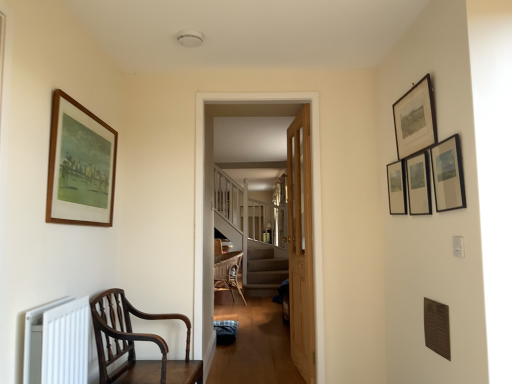
At what (x,y) coordinates should I click in order to perform the action: click on matte black picture frame at upper right, placed as the fourth picture frame when sorted from left to right. Please return your answer as a coordinate pair (x, y). Looking at the image, I should click on (418, 184).

This screenshot has height=384, width=512. Describe the element at coordinates (301, 246) in the screenshot. I see `wooden door at center` at that location.

Measure the distance between mahogany wood chair at lower left and camera.

mahogany wood chair at lower left and camera are 6.90 feet apart.

Describe the element at coordinates (134, 347) in the screenshot. I see `mahogany wood chair at lower left` at that location.

This screenshot has height=384, width=512. What do you see at coordinates (80, 165) in the screenshot?
I see `wooden framed print at upper left, the fifth picture frame viewed from the right` at bounding box center [80, 165].

What do you see at coordinates (57, 342) in the screenshot?
I see `white matte radiator at lower left` at bounding box center [57, 342].

I want to click on matte black picture frame at upper right, placed as the fourth picture frame when sorted from left to right, so click(418, 184).

Is matte black picture frame at upper right, the third picture frame from the right, far away from wooden framed print at upper left, the fifth picture frame viewed from the right?

Yes, matte black picture frame at upper right, the third picture frame from the right, and wooden framed print at upper left, the fifth picture frame viewed from the right, are quite far apart.

Which object is wider, matte black picture frame at upper right, which ranks as the third picture frame in left-to-right order, or wooden framed print at upper left, the first picture frame viewed from the left?

wooden framed print at upper left, the first picture frame viewed from the left.

Looking at this image, how many degrees apart are the facing directions of matte black picture frame at upper right, the third picture frame from the right, and wooden framed print at upper left, the first picture frame viewed from the left?

The angular difference between matte black picture frame at upper right, the third picture frame from the right, and wooden framed print at upper left, the first picture frame viewed from the left, is 180 degrees.

Is matte black picture frame at upper right, which ranks as the third picture frame in left-to-right order, looking in the opposite direction of wooden framed print at upper left, the fifth picture frame viewed from the right?

No, wooden framed print at upper left, the fifth picture frame viewed from the right, is not at the back of matte black picture frame at upper right, which ranks as the third picture frame in left-to-right order.

Is matte black picture frame at upper right, the third picture frame from the right, thinner than white matte radiator at lower left?

Indeed, matte black picture frame at upper right, the third picture frame from the right, has a lesser width compared to white matte radiator at lower left.

At what (x,y) coordinates should I click in order to perform the action: click on radiator in front of the matte black picture frame at upper right, the third picture frame from the right. Please return your answer as a coordinate pair (x, y). Image resolution: width=512 pixels, height=384 pixels. Looking at the image, I should click on (57, 342).

Between matte black picture frame at upper right, the third picture frame from the right, and white matte radiator at lower left, which one has larger size?

white matte radiator at lower left.

Is matte black picture frame at upper right, which ranks as the third picture frame in left-to-right order, facing towards white matte radiator at lower left?

Yes.

Is mahogany wood chair at lower left not within white matte radiator at lower left?

Yes, mahogany wood chair at lower left is not within white matte radiator at lower left.

Consider the image. Which of these two, mahogany wood chair at lower left or white matte radiator at lower left, is wider?

Wider between the two is mahogany wood chair at lower left.

Which object is closer to the camera, mahogany wood chair at lower left or white matte radiator at lower left?

white matte radiator at lower left is in front.

Is mahogany wood chair at lower left touching white matte radiator at lower left?

They are not placed beside each other.

Considering the sizes of objects matte black picture frame at upper right, the 1th picture frame in the right-to-left sequence, and mahogany wood chair at lower left in the image provided, who is bigger, matte black picture frame at upper right, the 1th picture frame in the right-to-left sequence, or mahogany wood chair at lower left?

mahogany wood chair at lower left.

Is matte black picture frame at upper right, marked as the fifth picture frame in a left-to-right arrangement, placed right next to mahogany wood chair at lower left?

No, matte black picture frame at upper right, marked as the fifth picture frame in a left-to-right arrangement, is not touching mahogany wood chair at lower left.

In the scene shown: Would you say matte black picture frame at upper right, marked as the fifth picture frame in a left-to-right arrangement, is to the left or to the right of mahogany wood chair at lower left in the picture?

matte black picture frame at upper right, marked as the fifth picture frame in a left-to-right arrangement, is to the right of mahogany wood chair at lower left.

Does matte black picture frame at upper right, marked as the fifth picture frame in a left-to-right arrangement, come in front of mahogany wood chair at lower left?

Yes, the depth of matte black picture frame at upper right, marked as the fifth picture frame in a left-to-right arrangement, is less than that of mahogany wood chair at lower left.

Which of these two, wooden framed print at upper left, the fifth picture frame viewed from the right, or matte black picture frame at upper right, placed as the fourth picture frame when sorted from left to right, is wider?

Wider between the two is wooden framed print at upper left, the fifth picture frame viewed from the right.

How many degrees apart are the facing directions of wooden framed print at upper left, the first picture frame viewed from the left, and matte black picture frame at upper right, placed as the fourth picture frame when sorted from left to right?

178 degrees separate the facing orientations of wooden framed print at upper left, the first picture frame viewed from the left, and matte black picture frame at upper right, placed as the fourth picture frame when sorted from left to right.

Considering the relative positions of wooden framed print at upper left, the fifth picture frame viewed from the right, and matte black picture frame at upper right, placed as the fourth picture frame when sorted from left to right, in the image provided, is wooden framed print at upper left, the fifth picture frame viewed from the right, to the right of matte black picture frame at upper right, placed as the fourth picture frame when sorted from left to right, from the viewer's perspective?

In fact, wooden framed print at upper left, the fifth picture frame viewed from the right, is to the left of matte black picture frame at upper right, placed as the fourth picture frame when sorted from left to right.

Who is smaller, wooden framed print at upper left, the first picture frame viewed from the left, or matte black picture frame at upper right, placed as the fourth picture frame when sorted from left to right?

With smaller size is matte black picture frame at upper right, placed as the fourth picture frame when sorted from left to right.

Between wooden framed print at upper left, the fifth picture frame viewed from the right, and matte black picture frame at upper right, marked as the fifth picture frame in a left-to-right arrangement, which one has smaller width?

matte black picture frame at upper right, marked as the fifth picture frame in a left-to-right arrangement, is thinner.

Is matte black picture frame at upper right, the 1th picture frame in the right-to-left sequence, a part of wooden framed print at upper left, the fifth picture frame viewed from the right?

No, matte black picture frame at upper right, the 1th picture frame in the right-to-left sequence, is not inside wooden framed print at upper left, the fifth picture frame viewed from the right.

What are the coordinates of `the 1st picture frame behind the matte black picture frame at upper right, the 1th picture frame in the right-to-left sequence` in the screenshot? It's located at (80, 165).

Is matte black picture frame at upper right, placed as the second picture frame when sorted from right to left, facing towards matte black picture frame at upper right, marked as the fifth picture frame in a left-to-right arrangement?

No, matte black picture frame at upper right, placed as the second picture frame when sorted from right to left, is not facing towards matte black picture frame at upper right, marked as the fifth picture frame in a left-to-right arrangement.

From a real-world perspective, is matte black picture frame at upper right, placed as the second picture frame when sorted from right to left, positioned above or below matte black picture frame at upper right, marked as the fifth picture frame in a left-to-right arrangement?

matte black picture frame at upper right, placed as the second picture frame when sorted from right to left, is below matte black picture frame at upper right, marked as the fifth picture frame in a left-to-right arrangement.

Identify the location of picture frame that is the 1st object located above the matte black picture frame at upper right, placed as the fourth picture frame when sorted from left to right (from the image's perspective). (448, 174).

Starting from the matte black picture frame at upper right, which ranks as the third picture frame in left-to-right order, which picture frame is the 2nd one to the left? Please provide its 2D coordinates.

[(80, 165)]

This screenshot has height=384, width=512. I want to click on picture frame that is the 5th object located behind the white matte radiator at lower left, so coord(397,187).

Looking at the image, which one is located closer to matte black picture frame at upper right, which ranks as the third picture frame in left-to-right order, matte black picture frame at upper right, the 1th picture frame in the right-to-left sequence, or wooden door at center?

matte black picture frame at upper right, the 1th picture frame in the right-to-left sequence, is positioned closer to the anchor matte black picture frame at upper right, which ranks as the third picture frame in left-to-right order.

When comparing their distances from white matte radiator at lower left, does matte black picture frame at upper right, the third picture frame from the right, or wooden framed print at upper left, the first picture frame viewed from the left, seem closer?

Based on the image, wooden framed print at upper left, the first picture frame viewed from the left, appears to be nearer to white matte radiator at lower left.

Considering their positions, is matte black picture frame at upper right, placed as the fourth picture frame when sorted from left to right, positioned further to matte black picture frame at upper right, marked as the fifth picture frame in a left-to-right arrangement, than matte black picture frame at upper right, which ranks as the third picture frame in left-to-right order?

The object further to matte black picture frame at upper right, marked as the fifth picture frame in a left-to-right arrangement, is matte black picture frame at upper right, which ranks as the third picture frame in left-to-right order.

Considering their positions, is wooden door at center positioned further to matte black picture frame at upper right, the 1th picture frame in the right-to-left sequence, than wooden framed print at upper left, the fifth picture frame viewed from the right?

Among the two, wooden framed print at upper left, the fifth picture frame viewed from the right, is located further to matte black picture frame at upper right, the 1th picture frame in the right-to-left sequence.

Estimate the real-world distances between objects in this image. Which object is closer to matte black picture frame at upper right, the 1th picture frame in the right-to-left sequence, mahogany wood chair at lower left or matte black picture frame at upper right, placed as the fourth picture frame when sorted from left to right?

matte black picture frame at upper right, placed as the fourth picture frame when sorted from left to right, is positioned closer to the anchor matte black picture frame at upper right, the 1th picture frame in the right-to-left sequence.

Looking at the image, which one is located further to matte black picture frame at upper right, placed as the fourth picture frame when sorted from left to right, wooden picture frame at upper right, the fourth picture frame when ordered from right to left, or wooden door at center?

wooden door at center is positioned further to the anchor matte black picture frame at upper right, placed as the fourth picture frame when sorted from left to right.

Based on their spatial positions, is wooden framed print at upper left, the first picture frame viewed from the left, or wooden door at center closer to wooden door at center?

The object closer to wooden door at center is wooden door at center.

When comparing their distances from wooden door at center, does matte black picture frame at upper right, placed as the fourth picture frame when sorted from left to right, or matte black picture frame at upper right, marked as the fifth picture frame in a left-to-right arrangement, seem closer?

matte black picture frame at upper right, placed as the fourth picture frame when sorted from left to right, is positioned closer to the anchor wooden door at center.

Locate an element on the screen. This screenshot has height=384, width=512. door located between wooden framed print at upper left, the fifth picture frame viewed from the right, and wooden picture frame at upper right, the fourth picture frame when ordered from right to left, in the left-right direction is located at coordinates [301, 246].

At what (x,y) coordinates should I click in order to perform the action: click on radiator between wooden framed print at upper left, the fifth picture frame viewed from the right, and wooden picture frame at upper right, which is counted as the second picture frame, starting from the left. Please return your answer as a coordinate pair (x, y). The height and width of the screenshot is (384, 512). Looking at the image, I should click on (57, 342).

You are a GUI agent. You are given a task and a screenshot of the screen. Output one action in this format:
    pyautogui.click(x=<x>, y=<y>)
    Task: Click on the chair located between wooden framed print at upper left, the fifth picture frame viewed from the right, and matte black picture frame at upper right, placed as the fourth picture frame when sorted from left to right, in the left-right direction
    
    Given the screenshot: What is the action you would take?
    pyautogui.click(x=134, y=347)

Locate an element on the screen. This screenshot has height=384, width=512. door between white matte radiator at lower left and matte black picture frame at upper right, placed as the fourth picture frame when sorted from left to right, from left to right is located at coordinates (301, 246).